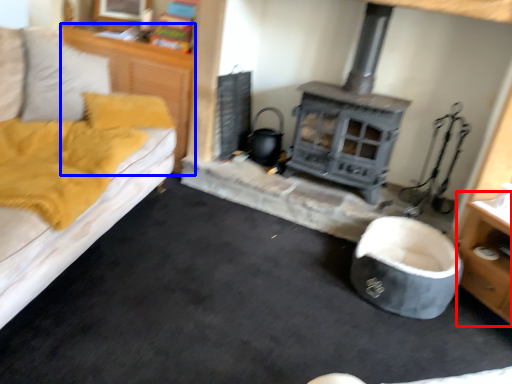
Question: Which object is closer to the camera taking this photo, dresser (highlighted by a red box) or dresser (highlighted by a blue box)?

Choices:
 (A) dresser
 (B) dresser

Answer: (A)